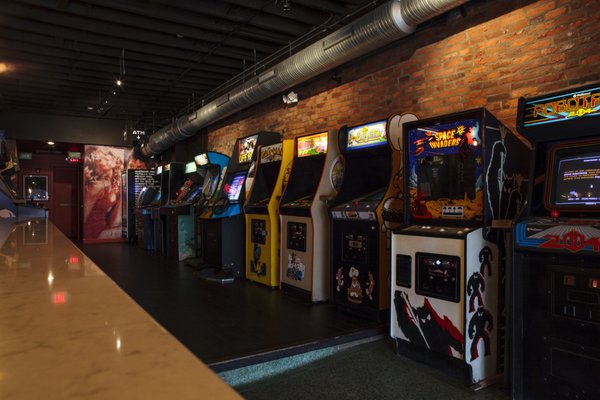
Locate an element on the screen. This screenshot has width=600, height=400. brick wall is located at coordinates (473, 67).